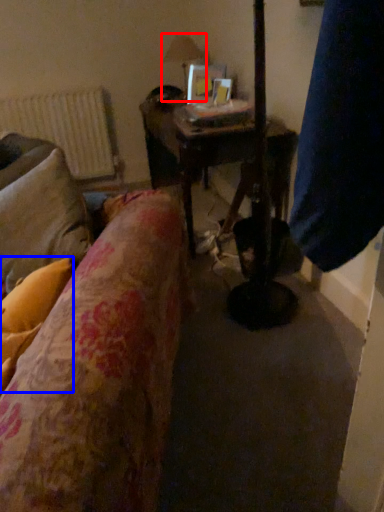
Question: Which object appears farthest to the camera in this image, table lamp (highlighted by a red box) or pillow (highlighted by a blue box)?

Choices:
 (A) table lamp
 (B) pillow

Answer: (A)